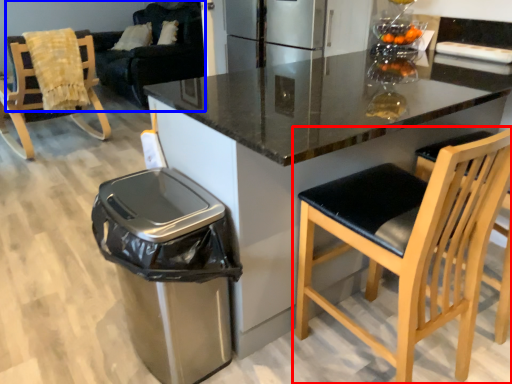
Question: Which object is closer to the camera taking this photo, chair (highlighted by a red box) or couch (highlighted by a blue box)?

Choices:
 (A) chair
 (B) couch

Answer: (A)